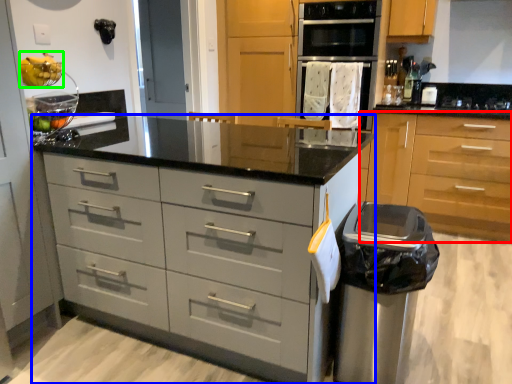
Question: Based on their relative distances, which object is nearer to cabinetry (highlighted by a red box)? Choose from chest of drawers (highlighted by a blue box) and fruit (highlighted by a green box).

Choices:
 (A) chest of drawers
 (B) fruit

Answer: (A)